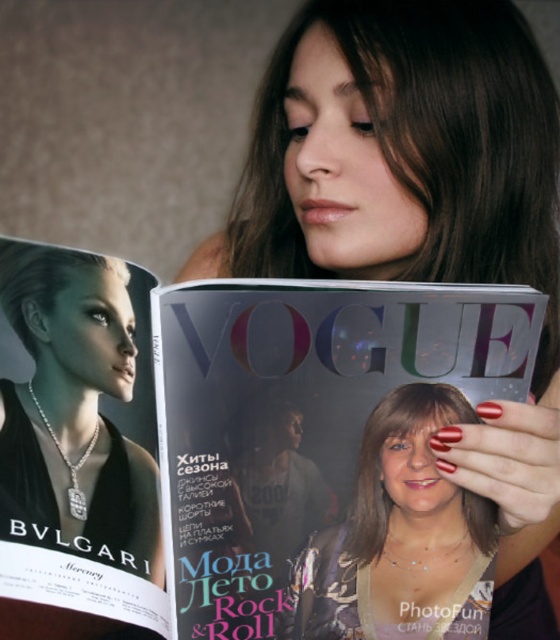
Is point (441, 147) behind point (440, 566)?

Yes, it is behind point (440, 566).

Which of these two, matte black magazine at center or matte silver necklace at center, stands taller?

matte black magazine at center is taller.

Which is in front, point (370, 26) or point (437, 604)?

Positioned in front is point (437, 604).

You are a GUI agent. You are given a task and a screenshot of the screen. Output one action in this format:
    pyautogui.click(x=<x>, y=<y>)
    Task: Click on the matte black magazine at center
    Image resolution: width=560 pixels, height=640 pixels.
    Given the screenshot: What is the action you would take?
    pyautogui.click(x=421, y=212)

Which is behind, point (8, 593) or point (394, 76)?

The point (394, 76) is behind.

Does matte silver magazine at center have a lesser width compared to matte black magazine at center?

Correct, matte silver magazine at center's width is less than matte black magazine at center's.

Where is `matte silver magazine at center`? matte silver magazine at center is located at coordinates (216, 432).

This screenshot has height=640, width=560. Find the location of `matte silver magazine at center`. matte silver magazine at center is located at coordinates 216,432.

Looking at this image, does matte silver magazine at center appear on the right side of matte silver necklace at center?

In fact, matte silver magazine at center is to the left of matte silver necklace at center.

Who is higher up, matte silver magazine at center or matte silver necklace at center?

matte silver magazine at center is higher up.

In order to click on matte silver magazine at center in this screenshot , I will do `click(216, 432)`.

Find the location of a particular element. matte silver magazine at center is located at coordinates (216, 432).